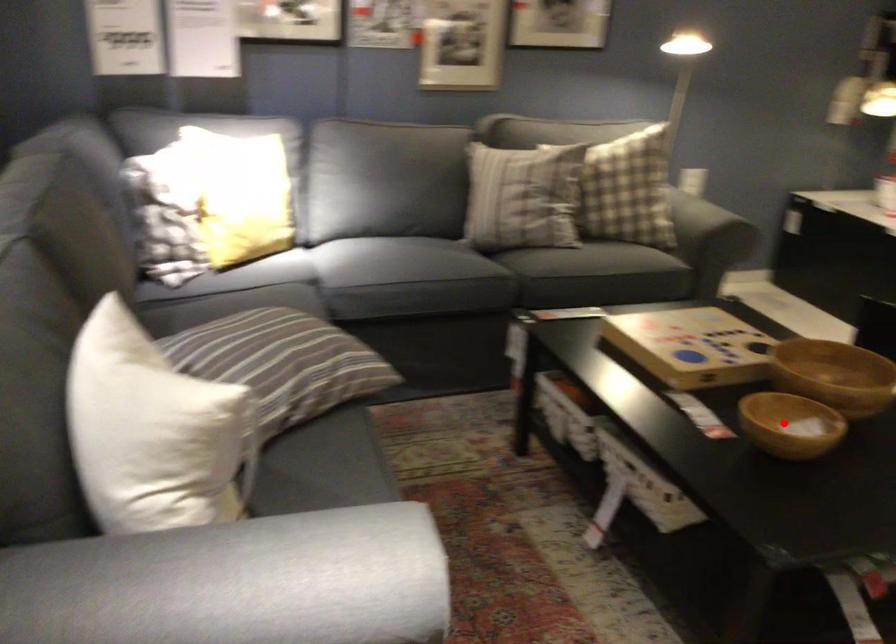
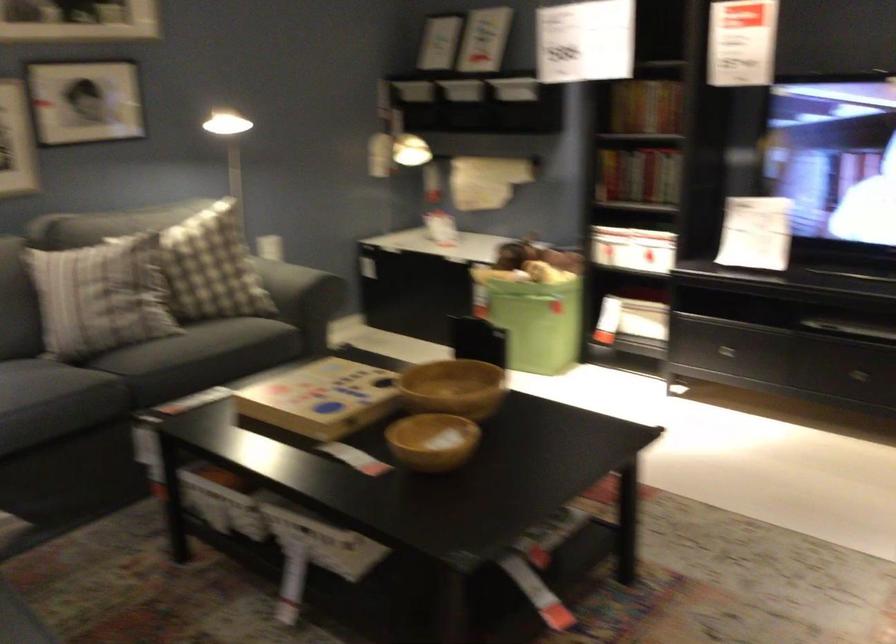
In the second image, find the point that corresponds to the highlighted location in the first image.

(433, 440)